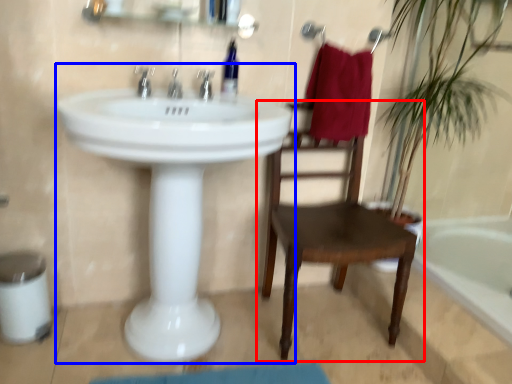
Question: Which of the following is the farthest to the observer, chair (highlighted by a red box) or sink (highlighted by a blue box)?

Choices:
 (A) chair
 (B) sink

Answer: (A)